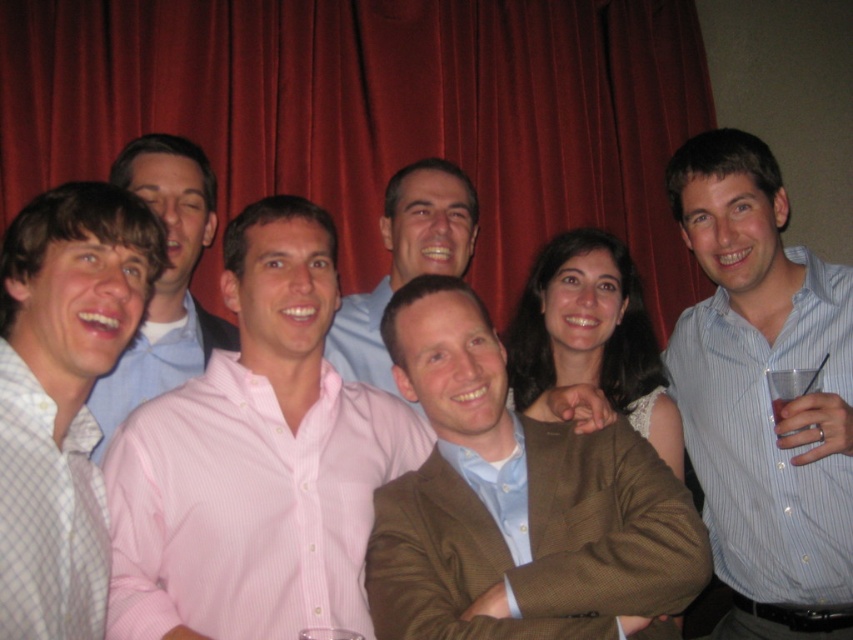
Does light blue checkered shirt at left have a greater height compared to pink striped shirt at left?

In fact, light blue checkered shirt at left may be shorter than pink striped shirt at left.

Does light blue checkered shirt at left come behind pink striped shirt at left?

No, light blue checkered shirt at left is closer to the viewer.

Who is more forward, (47, 310) or (167, 244)?

Point (47, 310) is more forward.

I want to click on light blue checkered shirt at left, so click(x=62, y=396).

Does pink striped shirt at center have a lesser width compared to brown textured blazer at center?

Incorrect, pink striped shirt at center's width is not less than brown textured blazer at center's.

At what (x,y) coordinates should I click in order to perform the action: click on pink striped shirt at center. Please return your answer as a coordinate pair (x, y). The height and width of the screenshot is (640, 853). Looking at the image, I should click on (256, 460).

Who is shorter, light blue checkered shirt at left or matte blue shirt at center?

matte blue shirt at center is shorter.

Is light blue checkered shirt at left positioned at the back of matte blue shirt at center?

That is False.

Identify the location of light blue checkered shirt at left. Image resolution: width=853 pixels, height=640 pixels. (62, 396).